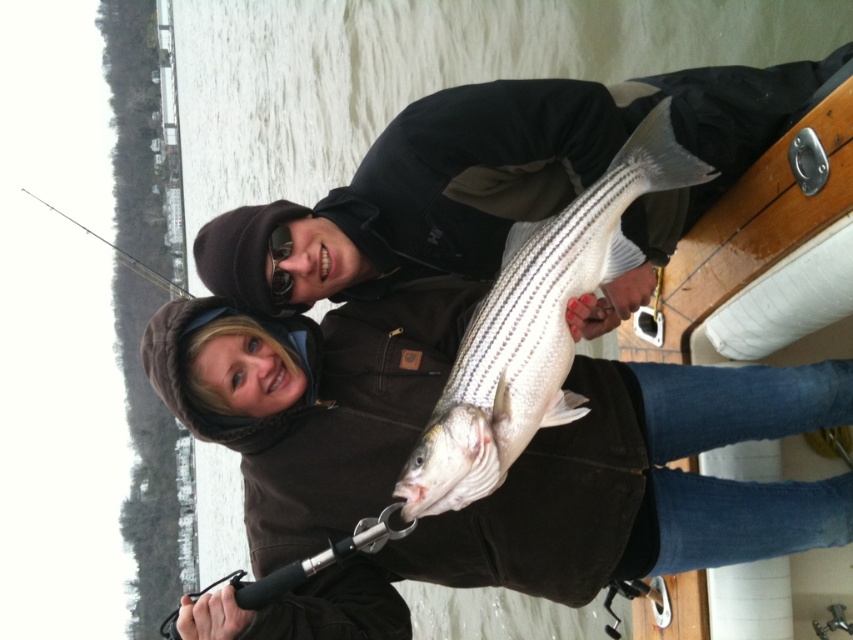
You are a photographer on the boat and want to take a photo of the white striped fish at center and the clear glass fishing pole at left. Since you have a camera with a fixed focal length, you need to know which object is wider to ensure proper framing. Can you tell me which one is wider?

The white striped fish at center has a lesser width compared to the clear glass fishing pole at left, so the clear glass fishing pole at left is wider and should be framed accordingly.

You are a photographer on the boat and want to take a closeup photo of the white striped fish at center and the clear glass fishing pole at left. Which object should you focus on first to ensure it appears sharp in the photo?

The white striped fish at center is closer to the viewer than the clear glass fishing pole at left, so you should focus on the white striped fish at center first to ensure it appears sharp in the photo.

In the scene shown: You are an observer on the boat looking at the white striped fish at center and the clear glass fishing pole at left. Which object takes up more visual space in the image?

The clear glass fishing pole at left takes up more visual space than the white striped fish at center because the white striped fish at center occupies less space than clear glass fishing pole at left.